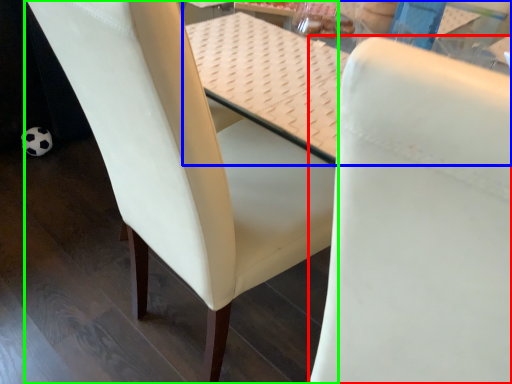
Question: Which is farther away from chair (highlighted by a red box)? table (highlighted by a blue box) or chair (highlighted by a green box)?

Choices:
 (A) table
 (B) chair

Answer: (A)